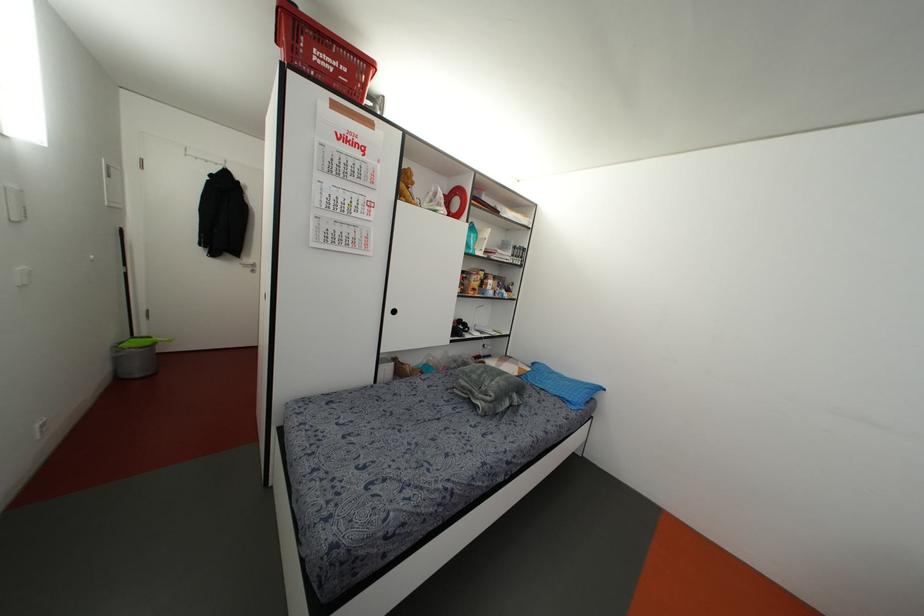
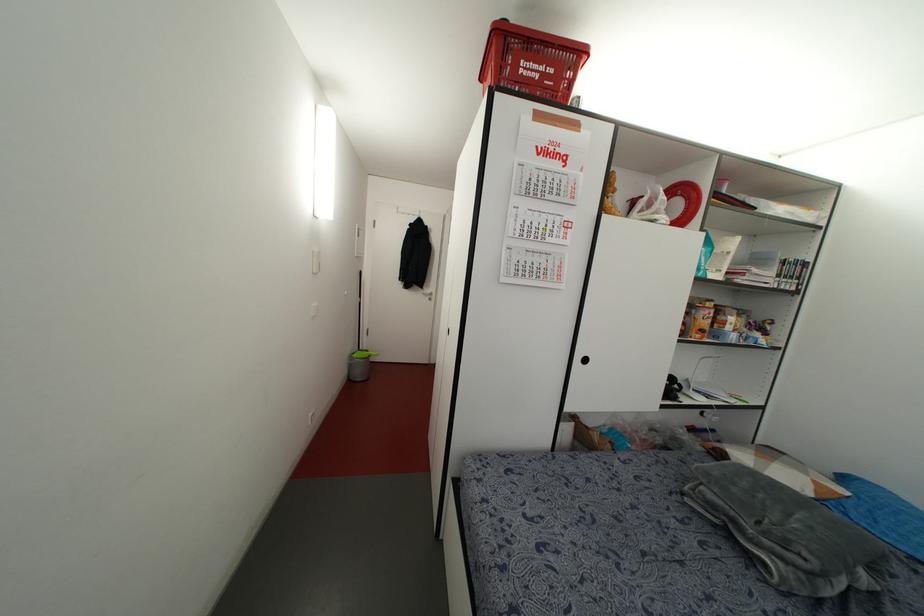
Question: The camera is either moving clockwise (left) or counter-clockwise (right) around the object. The first image is from the beginning of the video and the second image is from the end. Is the camera moving left or right when shooting the video?

Choices:
 (A) Left
 (B) Right

Answer: (B)